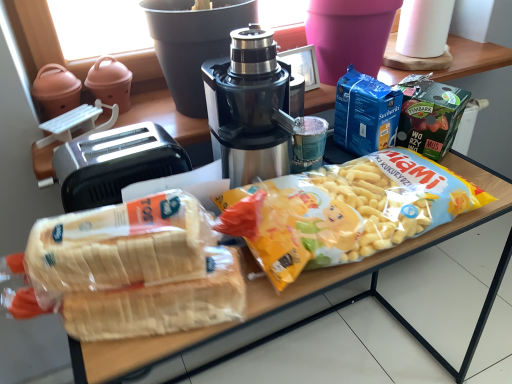
Question: From a real-world perspective, is stainless steel coffee maker at center positioned above or below translucent plastic bread at lower left?

Choices:
 (A) above
 (B) below

Answer: (A)

Question: In the image, is stainless steel coffee maker at center on the left side or the right side of translucent plastic bread at lower left?

Choices:
 (A) left
 (B) right

Answer: (B)

Question: Which of these objects is positioned farthest from the white paper towel at upper right?

Choices:
 (A) translucent plastic bread at lower left
 (B) translucent plastic bag of bread at center
 (C) stainless steel coffee maker at center
 (D) black plastic toaster at left

Answer: (A)

Question: Estimate the real-world distances between objects in this image. Which object is farther from the translucent plastic bag of bread at center?

Choices:
 (A) black plastic toaster at left
 (B) translucent plastic bread at lower left
 (C) white paper towel at upper right
 (D) stainless steel coffee maker at center

Answer: (C)